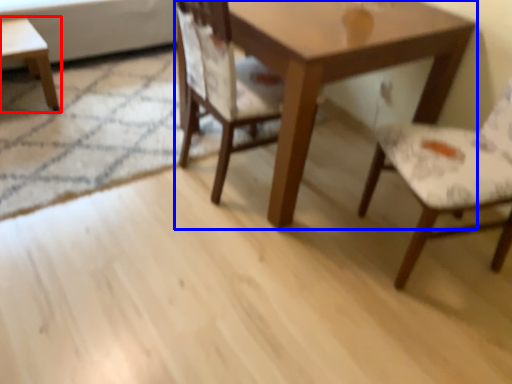
Question: Which object is further to the camera taking this photo, coffee table (highlighted by a red box) or table (highlighted by a blue box)?

Choices:
 (A) coffee table
 (B) table

Answer: (A)